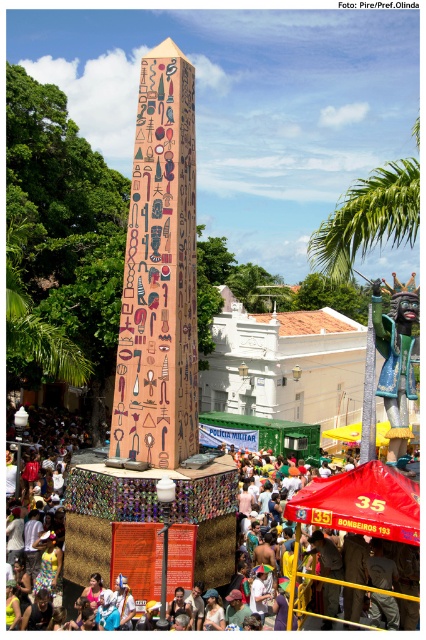
You are organizing a small gathering and need to place a 20 feet long table between the beige mosaic obelisk at center and the red fabric canopy at center. Is there enough space between them to accommodate the table?

The distance between the beige mosaic obelisk at center and the red fabric canopy at center is 32.88 feet. Since the table is 20 feet long, there is sufficient space to place it between them as the distance is greater than the table length.

You are standing in front of the obelisk and want to take a photo of both the point at coordinates point [103,522] and point [373,390]. Which point should you focus on first to ensure both are in focus?

You should focus on point [103,522] first since it is closer to the camera than point [373,390]. This ensures the closer point is in focus, and the farther point will also be sharp due to depth of field.

You are standing at the origin point of the coordinate system in the image. You want to locate the multicolored mosaic crowd at center. In which direction should you look?

The multicolored mosaic crowd at center is located at coordinate point 0.811 on the x axis and 0.237 on the y axis. Since the origin is at the bottom left corner of the image, you should look to the upper right direction to find the multicolored mosaic crowd at center.